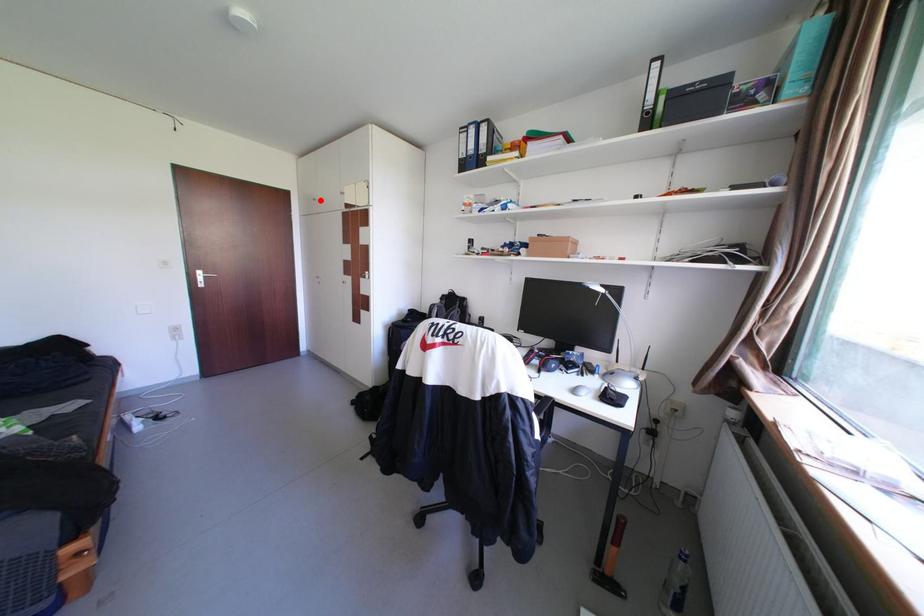
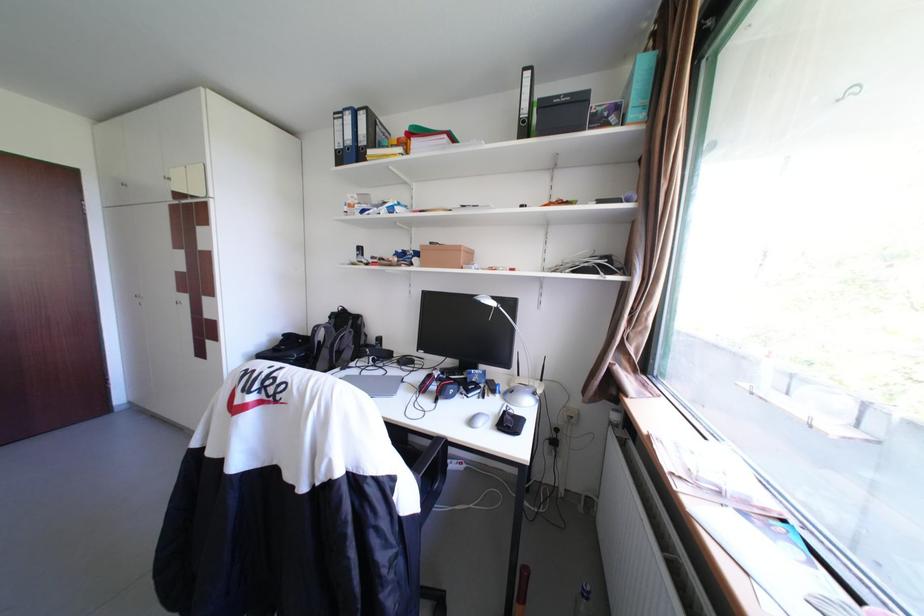
Question: I am providing you with two images of the same scene from different viewpoints. A red point is shown in image1. For the corresponding object point in image2, is it positioned nearer or farther from the camera?

Choices:
 (A) Nearer
 (B) Farther

Answer: (B)